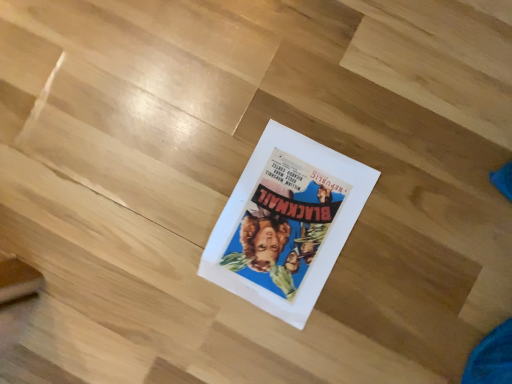
What are the coordinates of `blank space situated above white paper poster at center (from a real-world perspective)` in the screenshot? It's located at (285, 225).